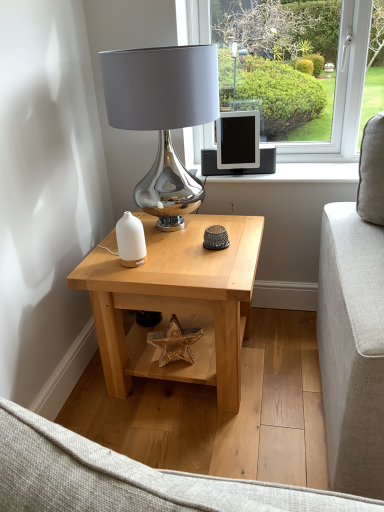
Question: Is natural wood table at center shorter than matte black tablet at center?

Choices:
 (A) yes
 (B) no

Answer: (B)

Question: Can you confirm if natural wood table at center is smaller than matte black tablet at center?

Choices:
 (A) no
 (B) yes

Answer: (A)

Question: Is natural wood table at center further to camera compared to matte black tablet at center?

Choices:
 (A) yes
 (B) no

Answer: (B)

Question: Is natural wood table at center positioned before matte black tablet at center?

Choices:
 (A) no
 (B) yes

Answer: (B)

Question: From the image's perspective, would you say natural wood table at center is shown under matte black tablet at center?

Choices:
 (A) yes
 (B) no

Answer: (A)

Question: Considering the positions of point (182, 187) and point (104, 375), is point (182, 187) closer or farther from the camera than point (104, 375)?

Choices:
 (A) farther
 (B) closer

Answer: (A)

Question: Would you say shiny metallic lamp at center is to the left or to the right of natural wood table at center in the picture?

Choices:
 (A) right
 (B) left

Answer: (B)

Question: Relative to natural wood table at center, is shiny metallic lamp at center in front or behind?

Choices:
 (A) front
 (B) behind

Answer: (A)

Question: From the image's perspective, is shiny metallic lamp at center above or below natural wood table at center?

Choices:
 (A) below
 (B) above

Answer: (B)

Question: Considering the positions of matte black tablet at center and shiny metallic lamp at center in the image, is matte black tablet at center bigger or smaller than shiny metallic lamp at center?

Choices:
 (A) big
 (B) small

Answer: (B)

Question: Considering their positions, is matte black tablet at center located in front of or behind shiny metallic lamp at center?

Choices:
 (A) behind
 (B) front

Answer: (A)

Question: From a real-world perspective, relative to shiny metallic lamp at center, is matte black tablet at center vertically above or below?

Choices:
 (A) above
 (B) below

Answer: (B)

Question: From the image's perspective, relative to shiny metallic lamp at center, is matte black tablet at center above or below?

Choices:
 (A) above
 (B) below

Answer: (A)

Question: From the image's perspective, relative to white glossy candle holder at center, is shiny metallic lamp at center above or below?

Choices:
 (A) above
 (B) below

Answer: (A)

Question: Considering the positions of shiny metallic lamp at center and white glossy candle holder at center in the image, is shiny metallic lamp at center bigger or smaller than white glossy candle holder at center?

Choices:
 (A) small
 (B) big

Answer: (B)